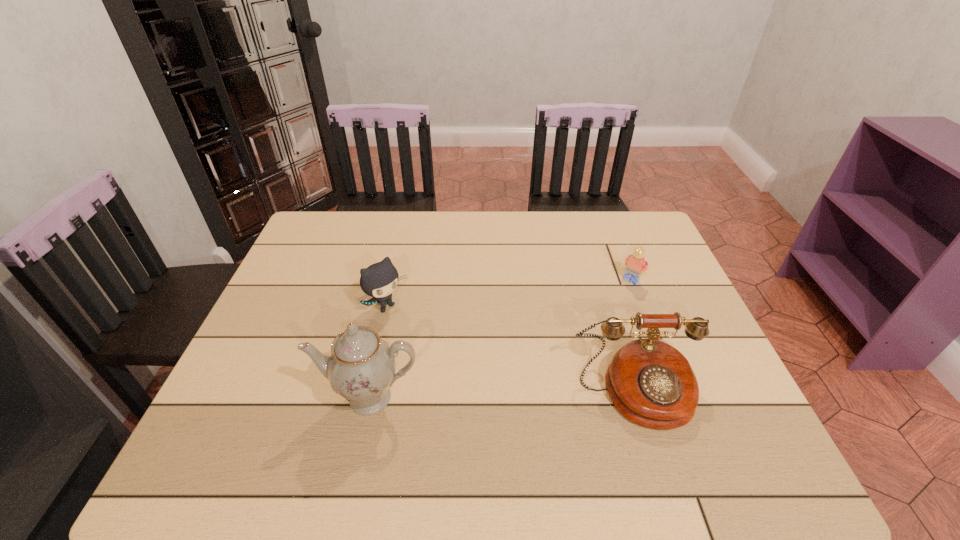
You are a GUI agent. You are given a task and a screenshot of the screen. Output one action in this format:
    pyautogui.click(x=<x>, y=<y>)
    Task: Click on the tallest object
    
    Given the screenshot: What is the action you would take?
    pyautogui.click(x=361, y=368)

Locate an element on the screen. The height and width of the screenshot is (540, 960). the second tallest object is located at coordinates (651, 383).

This screenshot has height=540, width=960. In order to click on kitten in this screenshot , I will do `click(379, 280)`.

Locate an element on the screen. This screenshot has width=960, height=540. the second farthest object is located at coordinates (379, 280).

Where is `the farthest object`? This screenshot has width=960, height=540. the farthest object is located at coordinates coord(635,264).

Find the location of a particular element. This screenshot has height=540, width=960. Lego is located at coordinates (635, 264).

You are a GUI agent. You are given a task and a screenshot of the screen. Output one action in this format:
    pyautogui.click(x=<x>, y=<y>)
    Task: Click on the free space located on the front-facing side of the second shortest object
    This screenshot has width=960, height=540.
    Given the screenshot: What is the action you would take?
    pyautogui.click(x=484, y=402)

Find the location of a particular element. This screenshot has width=960, height=540. blank space located on the front-facing side of the second shortest object is located at coordinates (413, 332).

Locate an element on the screen. blank space located on the front-facing side of the second shortest object is located at coordinates (413, 332).

Identify the location of free space located 0.400m on the front-facing side of the Lego. The image size is (960, 540). (548, 375).